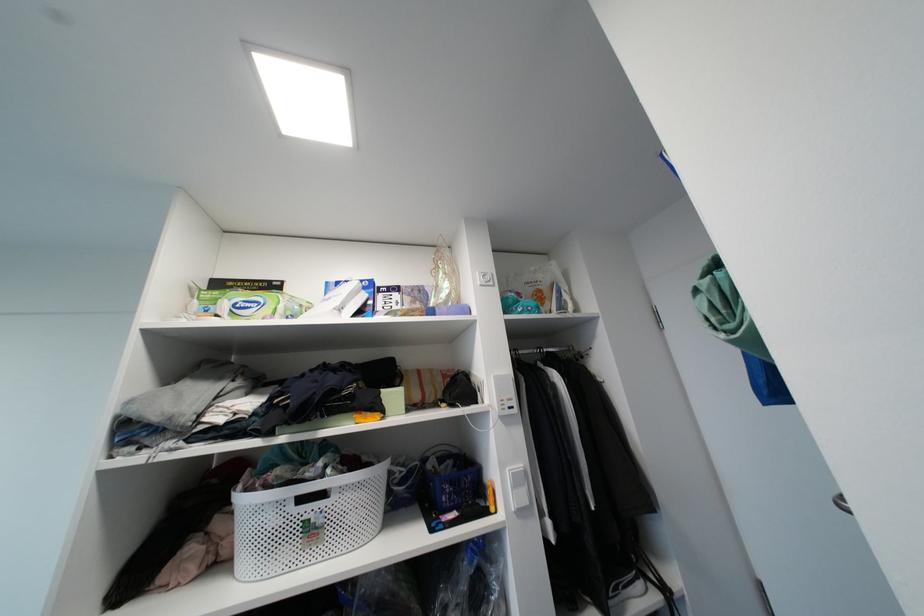
The image size is (924, 616). What are the coordinates of `white intercom unit` in the screenshot? It's located at (505, 394).